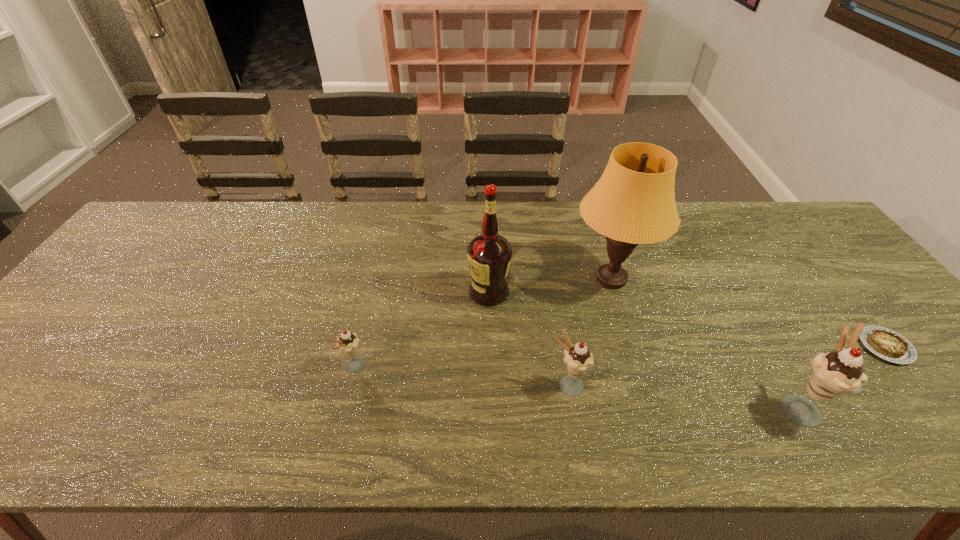
You are a GUI agent. You are given a task and a screenshot of the screen. Output one action in this format:
    pyautogui.click(x=<x>, y=<y>)
    Task: Click on the blank space located on the left of the leftmost object
    
    Given the screenshot: What is the action you would take?
    pyautogui.click(x=176, y=367)

At what (x,y) coordinates should I click in order to perform the action: click on free point located on the right of the second tallest icecream. Please return your answer as a coordinate pair (x, y). Looking at the image, I should click on (733, 386).

Where is `free space located on the back of the tallest icecream`? The width and height of the screenshot is (960, 540). free space located on the back of the tallest icecream is located at coordinates (719, 268).

Find the location of a particular element. The height and width of the screenshot is (540, 960). vacant space located on the left of the lampshade is located at coordinates (500, 279).

The height and width of the screenshot is (540, 960). Find the location of `vacant space situated on the back of the shortest object`. vacant space situated on the back of the shortest object is located at coordinates (847, 299).

Find the location of a particular element. The width and height of the screenshot is (960, 540). free point located 0.290m on the label of the alcohol is located at coordinates (362, 292).

Where is `free region located on the label of the alcohol`? The height and width of the screenshot is (540, 960). free region located on the label of the alcohol is located at coordinates (417, 292).

Identify the location of vacant space located 0.300m on the label of the alcohol. This screenshot has height=540, width=960. (358, 292).

Locate an element on the screen. Image resolution: width=960 pixels, height=540 pixels. object that is at the right edge is located at coordinates click(889, 345).

Find the location of a particular element. The height and width of the screenshot is (540, 960). free space at the far edge of the desktop is located at coordinates (372, 231).